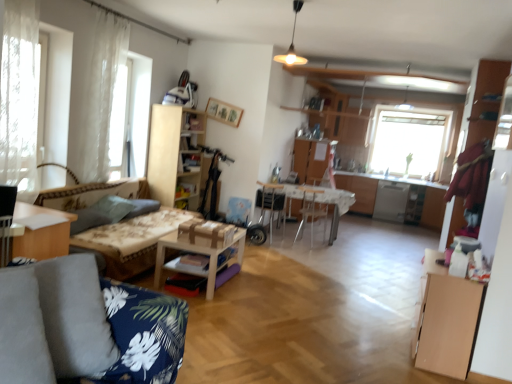
The image size is (512, 384). In order to click on white sheer curtain at left, which appears as the 2th window when viewed from the front in this screenshot , I will do point(130,117).

Image resolution: width=512 pixels, height=384 pixels. Describe the element at coordinates (195, 252) in the screenshot. I see `wooden table at center, which appears as the 2th table when viewed from the right` at that location.

Measure the distance between point (x=162, y=266) and camera.

3.78 meters.

Image resolution: width=512 pixels, height=384 pixels. Describe the element at coordinates (446, 320) in the screenshot. I see `light brown wood cabinet at lower right, which is counted as the 2th cabinetry, starting from the left` at that location.

Find the location of a particular element. wooden chair at center, positioned as the first armchair in right-to-left order is located at coordinates (312, 205).

What are the coordinates of `white sheer curtain at left, which ranks as the 2th window in left-to-right order` in the screenshot? It's located at (130, 117).

Looking at the image, does transparent glass window at center, the first window from the right, seem bigger or smaller compared to metallic silver chair at center?

transparent glass window at center, the first window from the right, is bigger than metallic silver chair at center.

Is transparent glass window at center, which ranks as the third window in left-to-right order, looking in the opposite direction of metallic silver chair at center?

transparent glass window at center, which ranks as the third window in left-to-right order, is not turned away from metallic silver chair at center.

In the scene shown: Are transparent glass window at center, which appears as the 3th window when viewed from the front, and metallic silver chair at center far apart?

transparent glass window at center, which appears as the 3th window when viewed from the front, is far away from metallic silver chair at center.

Looking at this image, is transparent glass window at center, which appears as the 3th window when viewed from the front, inside the boundaries of metallic silver chair at center, or outside?

transparent glass window at center, which appears as the 3th window when viewed from the front, is outside metallic silver chair at center.

Does light wood cabinet at center, placed as the 1th cabinetry when sorted from top to bottom, appear on the left side of metallic silver chair at center?

Correct, you'll find light wood cabinet at center, placed as the 1th cabinetry when sorted from top to bottom, to the left of metallic silver chair at center.

In the image, is light wood cabinet at center, placed as the first cabinetry when sorted from back to front, positioned in front of or behind metallic silver chair at center?

light wood cabinet at center, placed as the first cabinetry when sorted from back to front, is positioned closer to the viewer than metallic silver chair at center.

Is light wood cabinet at center, placed as the first cabinetry when sorted from back to front, facing towards metallic silver chair at center?

No, light wood cabinet at center, placed as the first cabinetry when sorted from back to front, is not oriented towards metallic silver chair at center.

From a real-world perspective, is white sheer curtain at left, arranged as the 2th window when viewed from the back, over dark blue floral fabric couch at lower left?

Correct, in the physical world, white sheer curtain at left, arranged as the 2th window when viewed from the back, is higher than dark blue floral fabric couch at lower left.

Between white sheer curtain at left, arranged as the 2th window when viewed from the back, and dark blue floral fabric couch at lower left, which one is positioned in front?

dark blue floral fabric couch at lower left is more forward.

From the image's perspective, which is below, white sheer curtain at left, which is the 2th window from right to left, or dark blue floral fabric couch at lower left?

dark blue floral fabric couch at lower left, from the image's perspective.

Considering the relative positions of white sheer curtain at left, which ranks as the 2th window in left-to-right order, and dark blue floral fabric couch at lower left in the image provided, is white sheer curtain at left, which ranks as the 2th window in left-to-right order, to the right of dark blue floral fabric couch at lower left from the viewer's perspective?

In fact, white sheer curtain at left, which ranks as the 2th window in left-to-right order, is to the left of dark blue floral fabric couch at lower left.

Consider the image. Who is taller, white glossy table at center, arranged as the first table when viewed from the back, or white sheer curtain at left, which ranks as the 2th window in left-to-right order?

Standing taller between the two is white sheer curtain at left, which ranks as the 2th window in left-to-right order.

Locate an element on the screen. This screenshot has width=512, height=384. the 2nd table counting from the right of the white sheer curtain at left, arranged as the 2th window when viewed from the back is located at coordinates (319, 200).

Could white sheer curtain at left, which appears as the 2th window when viewed from the front, be considered to be inside white glossy table at center, which ranks as the first table in right-to-left order?

No, white sheer curtain at left, which appears as the 2th window when viewed from the front, is not inside white glossy table at center, which ranks as the first table in right-to-left order.

Visually, is floral fabric couch at left positioned to the left or to the right of satin silver dishwasher at right?

floral fabric couch at left is positioned on satin silver dishwasher at right's left side.

Can you confirm if floral fabric couch at left is thinner than satin silver dishwasher at right?

No.

Considering the relative positions of floral fabric couch at left and satin silver dishwasher at right in the image provided, is floral fabric couch at left in front of satin silver dishwasher at right?

Yes, floral fabric couch at left is closer to the camera.

Which is more to the left, wooden shelf at center or transparent glass window at center, the 1th window viewed from the back?

wooden shelf at center is more to the left.

From the picture: Considering the relative sizes of wooden shelf at center and transparent glass window at center, which appears as the 3th window when viewed from the front, in the image provided, is wooden shelf at center wider than transparent glass window at center, which appears as the 3th window when viewed from the front,?

Incorrect, the width of wooden shelf at center does not surpass that of transparent glass window at center, which appears as the 3th window when viewed from the front.

Is point (190, 161) positioned before point (377, 113)?

That is True.

Is wooden shelf at center looking in the opposite direction of transparent glass window at center, the 1th window viewed from the back?

wooden shelf at center does not have its back to transparent glass window at center, the 1th window viewed from the back.

From the image's perspective, which is below, light brown wooden table at lower left, the third table positioned from the right, or metallic silver chair at center?

From the image's view, light brown wooden table at lower left, the third table positioned from the right, is below.

Is light brown wooden table at lower left, acting as the first table starting from the left, turned away from metallic silver chair at center?

No, metallic silver chair at center is not at the back of light brown wooden table at lower left, acting as the first table starting from the left.

Is light brown wooden table at lower left, the third table positioned from the right, located outside metallic silver chair at center?

That's correct, light brown wooden table at lower left, the third table positioned from the right, is outside of metallic silver chair at center.

Considering the positions of points (66, 236) and (335, 212), is point (66, 236) closer to camera compared to point (335, 212)?

Yes, it is.

From a real-world perspective, starting from the metallic silver chair at center, which window is the 3rd one vertically above it? Please provide its 2D coordinates.

[(408, 141)]

In order to click on cabinetry located above the metallic silver chair at center (from the image's perspective) in this screenshot , I will do `click(176, 155)`.

Which object lies nearer to the anchor point wooden chair at center, arranged as the second armchair when viewed from the front, white sheer curtain at left, the 1th window from the left, or dark blue floral fabric couch at lower left?

white sheer curtain at left, the 1th window from the left.

Based on their spatial positions, is floral fabric couch at left or wooden armchair at center, the first armchair positioned from the left, closer to light brown wooden table at lower left, the third table positioned from the right?

The object closer to light brown wooden table at lower left, the third table positioned from the right, is floral fabric couch at left.

From the image, which object appears to be nearer to green fabric pillow at center, positioned as the 1th pillow in front-to-back order, white sheer curtain at left or gray fabric pillow at left, the second pillow when ordered from front to back?

gray fabric pillow at left, the second pillow when ordered from front to back, is closer to green fabric pillow at center, positioned as the 1th pillow in front-to-back order.

Which object lies nearer to the anchor point transparent glass window at center, the 1th window viewed from the back, light wood cabinet at center, which ranks as the 2th cabinetry in right-to-left order, or dark blue floral fabric couch at lower left?

light wood cabinet at center, which ranks as the 2th cabinetry in right-to-left order, lies closer to transparent glass window at center, the 1th window viewed from the back, than the other object.

Estimate the real-world distances between objects in this image. Which object is further from wooden shelf at center, gray fabric pillow at left, arranged as the 1th pillow when viewed from the back, or wooden chair at center, arranged as the second armchair when viewed from the front?

The object further to wooden shelf at center is wooden chair at center, arranged as the second armchair when viewed from the front.

Looking at the image, which one is located closer to wooden armchair at center, the first armchair positioned from the left, light brown wood cabinet at lower right, the first cabinetry from the front, or light wood cabinet at center, the second cabinetry from the bottom?

The object closer to wooden armchair at center, the first armchair positioned from the left, is light wood cabinet at center, the second cabinetry from the bottom.

From the image, which object appears to be farther from white sheer curtain at left, which is counted as the 3th window, starting from the back, light brown wooden table at lower left, the third table from the back, or light brown wood cabinet at lower right, which is the second cabinetry from top to bottom?

Based on the image, light brown wood cabinet at lower right, which is the second cabinetry from top to bottom, appears to be further to white sheer curtain at left, which is counted as the 3th window, starting from the back.

Looking at this image, estimate the real-world distances between objects in this image. Which object is further from satin silver dishwasher at right, transparent glass window at center, which ranks as the third window in left-to-right order, or light brown wooden table at lower left, the 1th table in the front-to-back sequence?

Among the two, light brown wooden table at lower left, the 1th table in the front-to-back sequence, is located further to satin silver dishwasher at right.

Image resolution: width=512 pixels, height=384 pixels. I want to click on curtain between dark blue floral fabric couch at lower left and white glossy table at center, arranged as the first table when viewed from the back, from front to back, so click(102, 94).

You are a GUI agent. You are given a task and a screenshot of the screen. Output one action in this format:
    pyautogui.click(x=<x>, y=<y>)
    Task: Click on the cabinetry between green fabric pillow at center, the second pillow from the back, and wooden shelf at center from front to back
    This screenshot has width=512, height=384.
    Given the screenshot: What is the action you would take?
    pyautogui.click(x=176, y=155)

Where is `armchair between light brown wooden table at lower left, acting as the first table starting from the left, and wooden shelf at center, along the z-axis`? Image resolution: width=512 pixels, height=384 pixels. armchair between light brown wooden table at lower left, acting as the first table starting from the left, and wooden shelf at center, along the z-axis is located at coordinates (271, 202).

At what (x,y) coordinates should I click in order to perform the action: click on cabinetry located between white sheer curtain at left and white glossy table at center, arranged as the first table when viewed from the back, in the left-right direction. Please return your answer as a coordinate pair (x, y). The width and height of the screenshot is (512, 384). Looking at the image, I should click on pyautogui.click(x=176, y=155).